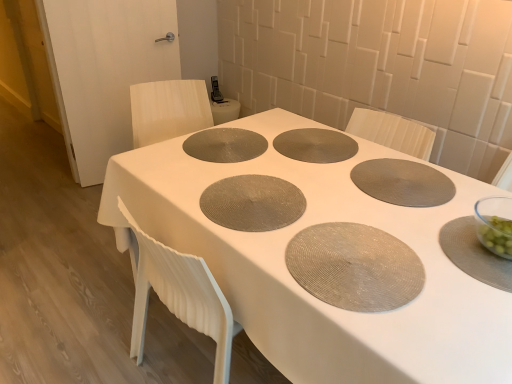
You are a GUI agent. You are given a task and a screenshot of the screen. Output one action in this format:
    pyautogui.click(x=<x>, y=<y>)
    Task: Click on the vacant area that lies to the right of matte gray placemat at center, positioned as the 3th pizza pan in right-to-left order
    The height and width of the screenshot is (384, 512).
    Given the screenshot: What is the action you would take?
    pyautogui.click(x=340, y=203)